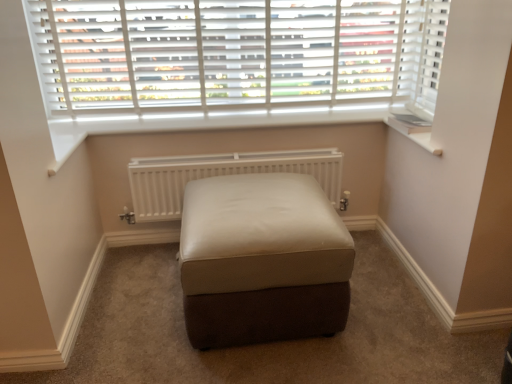
You are a GUI agent. You are given a task and a screenshot of the screen. Output one action in this format:
    pyautogui.click(x=<x>, y=<y>)
    Task: Click on the free location to the right of leather ottoman at center
    
    Given the screenshot: What is the action you would take?
    pyautogui.click(x=398, y=310)